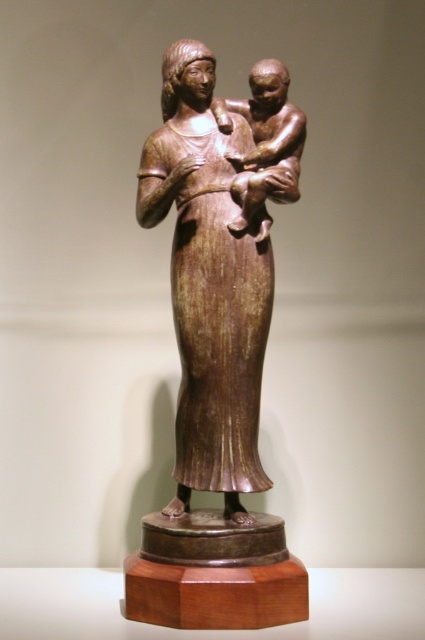
Which of these two, bronze statue at center or bronze baby at center, stands taller?

Standing taller between the two is bronze statue at center.

The image size is (425, 640). In order to click on bronze statue at center in this screenshot , I will do `click(215, 355)`.

What do you see at coordinates (215, 355) in the screenshot? The width and height of the screenshot is (425, 640). I see `bronze statue at center` at bounding box center [215, 355].

Identify the location of bronze statue at center. This screenshot has height=640, width=425. (215, 355).